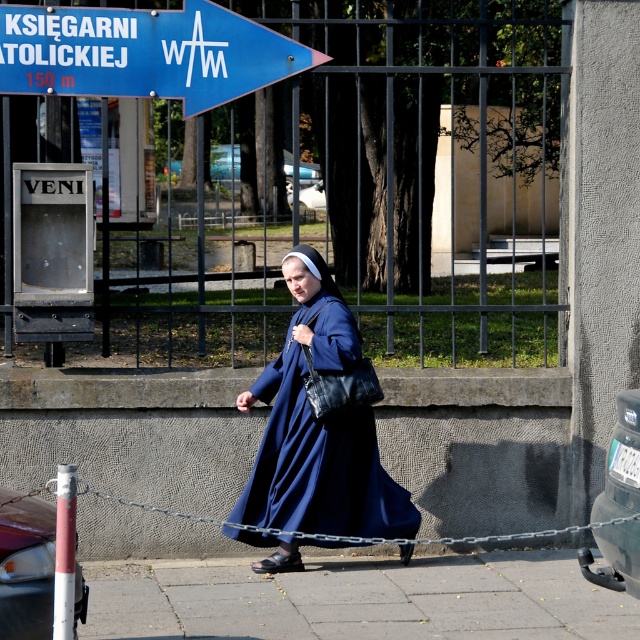
Is gray concrete pavement at lower center to the left of blue matte dress at center from the viewer's perspective?

Incorrect, gray concrete pavement at lower center is not on the left side of blue matte dress at center.

Is point (324, 609) farther from camera compared to point (323, 492)?

No, it is not.

Does point (561, 588) come closer to viewer compared to point (316, 545)?

No, it is not.

Identify the location of gray concrete pavement at lower center. pyautogui.click(x=356, y=598).

Describe the element at coordinates (317, 428) in the screenshot. This screenshot has height=640, width=640. I see `blue matte dress at center` at that location.

Does blue matte dress at center have a lesser height compared to metallic silver chain at lower center?

In fact, blue matte dress at center may be taller than metallic silver chain at lower center.

Looking at this image, measure the distance between point (268, 496) and camera.

The distance of point (268, 496) from camera is 10.02 meters.

I want to click on blue matte dress at center, so click(317, 428).

Does gray concrete pavement at lower center appear on the left side of metallic silver chain at lower center?

In fact, gray concrete pavement at lower center is to the right of metallic silver chain at lower center.

Consider the image. Could you measure the distance between gray concrete pavement at lower center and metallic silver chain at lower center?

gray concrete pavement at lower center is 23.04 inches from metallic silver chain at lower center.

Between point (276, 580) and point (620, 518), which one is positioned behind?

The point (276, 580) is behind.

I want to click on gray concrete pavement at lower center, so click(x=356, y=598).